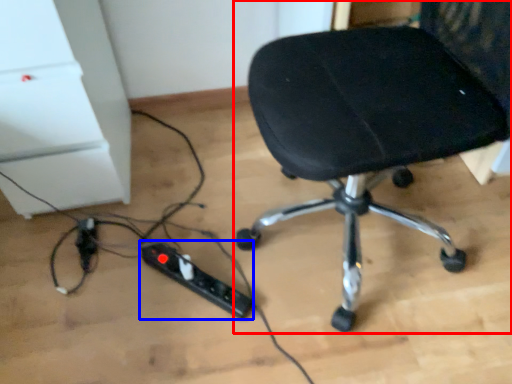
Question: Which object appears farthest to the camera in this image, chair (highlighted by a red box) or extension cord (highlighted by a blue box)?

Choices:
 (A) chair
 (B) extension cord

Answer: (B)